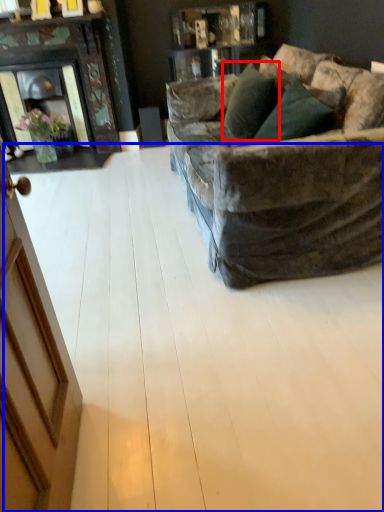
Question: Among these objects, which one is nearest to the camera, pillow (highlighted by a red box) or plywood (highlighted by a blue box)?

Choices:
 (A) pillow
 (B) plywood

Answer: (B)